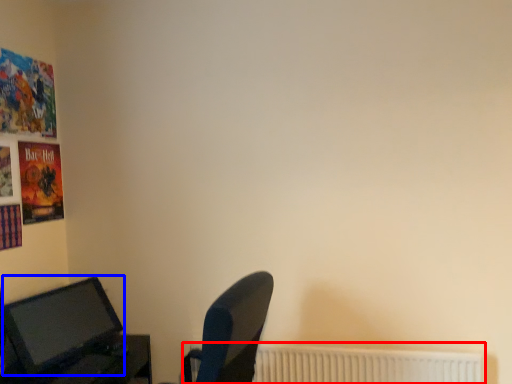
Question: Which point is further to the camera, radiator (highlighted by a red box) or computer monitor (highlighted by a blue box)?

Choices:
 (A) radiator
 (B) computer monitor

Answer: (A)